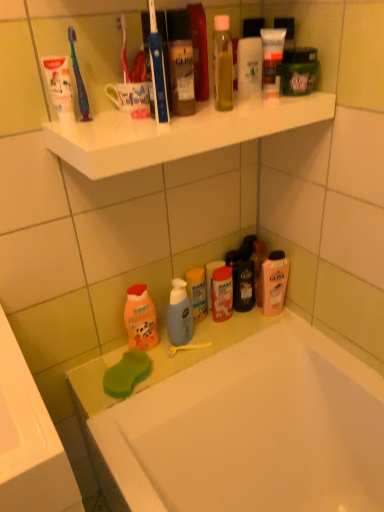
This screenshot has width=384, height=512. Identify the location of empty space that is in between pink glossy mouthwash at lower right, the 2th mouthwash positioned from the front, and green sponge at lower left. (210, 343).